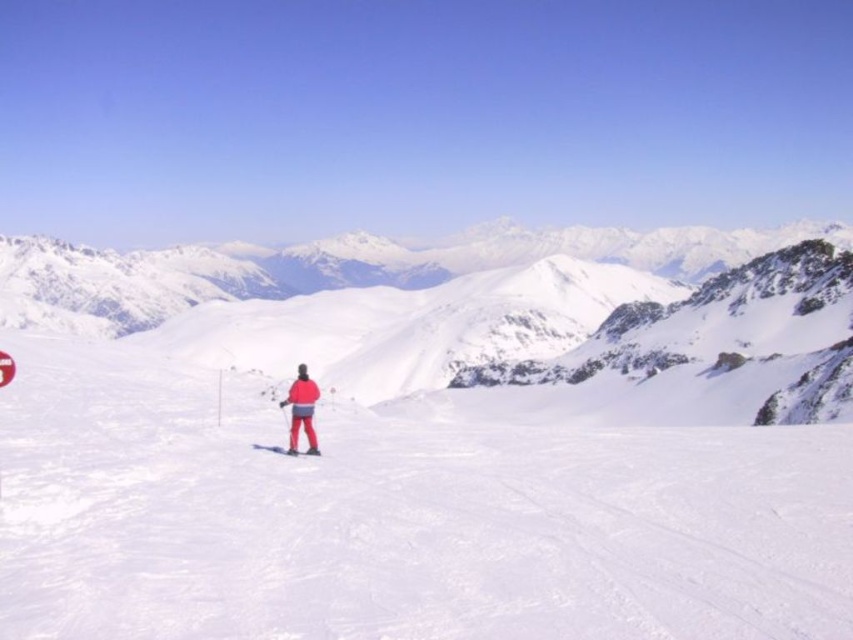
Looking at this image, you are a photographer positioned at the camera location. You want to capture a photo where both the point at coordinates point (294, 410) and the point at coordinates point (314, 454) are visible. Which point should you focus on first to ensure both are in sharp focus?

You should focus on point (294, 410) first because it is closer to the camera than point (314, 454). By focusing on the closer point, the farther point will also be within the depth of field, ensuring both are in sharp focus.

You are a drone operator tasked with capturing aerial footage of the winter landscape. The drone must fly from the rocky outcrops in the midground to the snowcovered mountains in the background. To avoid obstacles, the drone needs to pass above the matte red jacket at center. Given the coordinates provided, can the drone safely navigate this path without flying too close to the jacket?

The matte red jacket at center is located at point (300, 410). Since the drone is flying from the rocky outcrops in the midground to the snowcovered mountains in the background, its path would naturally pass above the jacket without being too close, as the jacket is centrally positioned and the drone can adjust its altitude accordingly.